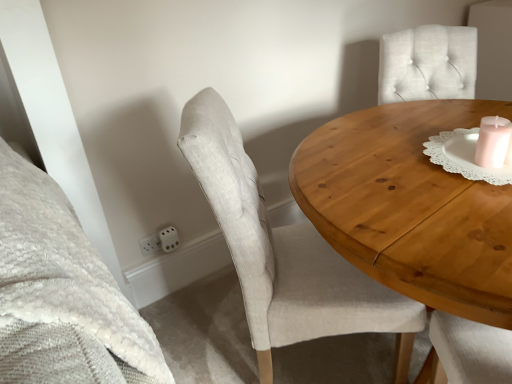
Find the location of a particular element. light gray fabric chair at center is located at coordinates (285, 254).

What do you see at coordinates (285, 254) in the screenshot?
I see `light gray fabric chair at center` at bounding box center [285, 254].

You are a GUI agent. You are given a task and a screenshot of the screen. Output one action in this format:
    pyautogui.click(x=<x>, y=<y>)
    Task: Click on the light gray fabric chair at center
    The width and height of the screenshot is (512, 384).
    Given the screenshot: What is the action you would take?
    pyautogui.click(x=285, y=254)